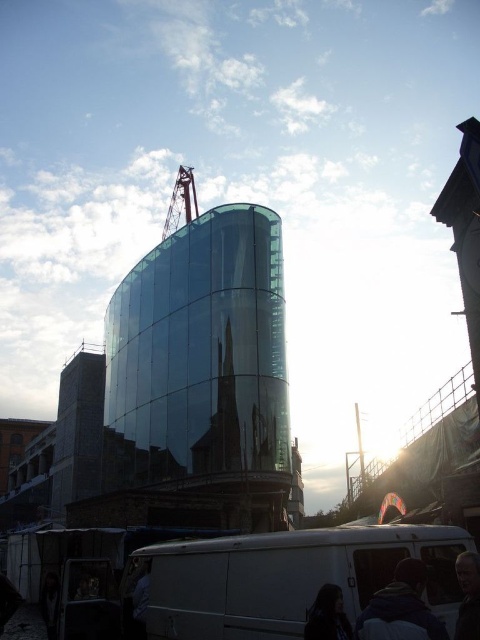
Does dark blue jacket at lower center have a greater height compared to dark hair at lower center?

Indeed, dark blue jacket at lower center has a greater height compared to dark hair at lower center.

The height and width of the screenshot is (640, 480). What do you see at coordinates (400, 609) in the screenshot?
I see `dark blue jacket at lower center` at bounding box center [400, 609].

Image resolution: width=480 pixels, height=640 pixels. Identify the location of dark blue jacket at lower center. (400, 609).

Does transparent glass tower at upper center appear on the right side of dark hair at lower center?

Yes, transparent glass tower at upper center is to the right of dark hair at lower center.

Who is more distant from viewer, (468, 138) or (325, 614)?

Positioned behind is point (468, 138).

Where is `transparent glass tower at upper center`? The height and width of the screenshot is (640, 480). transparent glass tower at upper center is located at coordinates (466, 230).

Between point (268, 369) and point (50, 593), which one is positioned in front?

Positioned in front is point (50, 593).

This screenshot has height=640, width=480. What do you see at coordinates (203, 365) in the screenshot? I see `transparent glass tower at center` at bounding box center [203, 365].

Does point (241, 289) lie in front of point (46, 625)?

No.

Where is `transparent glass tower at center`? The image size is (480, 640). transparent glass tower at center is located at coordinates (203, 365).